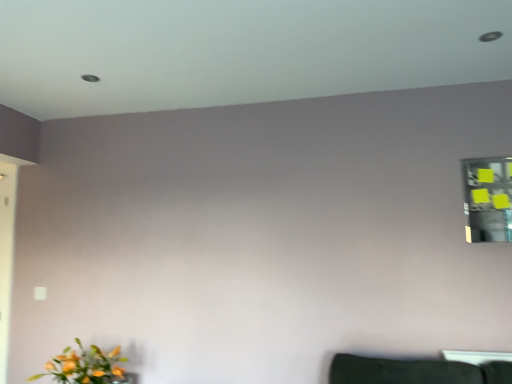
Question: Looking at their shapes, would you say yellow sticky notes at upper right is wider or thinner than matte orange flowers at lower left?

Choices:
 (A) thin
 (B) wide

Answer: (A)

Question: Considering the positions of yellow sticky notes at upper right and matte orange flowers at lower left in the image, is yellow sticky notes at upper right bigger or smaller than matte orange flowers at lower left?

Choices:
 (A) small
 (B) big

Answer: (A)

Question: Considering their positions, is yellow sticky notes at upper right located in front of or behind matte orange flowers at lower left?

Choices:
 (A) behind
 (B) front

Answer: (A)

Question: In the image, is matte orange flowers at lower left on the left side or the right side of yellow sticky notes at upper right?

Choices:
 (A) left
 (B) right

Answer: (A)

Question: Relative to yellow sticky notes at upper right, is matte orange flowers at lower left in front or behind?

Choices:
 (A) front
 (B) behind

Answer: (A)

Question: In terms of height, does matte orange flowers at lower left look taller or shorter compared to yellow sticky notes at upper right?

Choices:
 (A) short
 (B) tall

Answer: (A)

Question: Looking at their shapes, would you say matte orange flowers at lower left is wider or thinner than yellow sticky notes at upper right?

Choices:
 (A) wide
 (B) thin

Answer: (A)